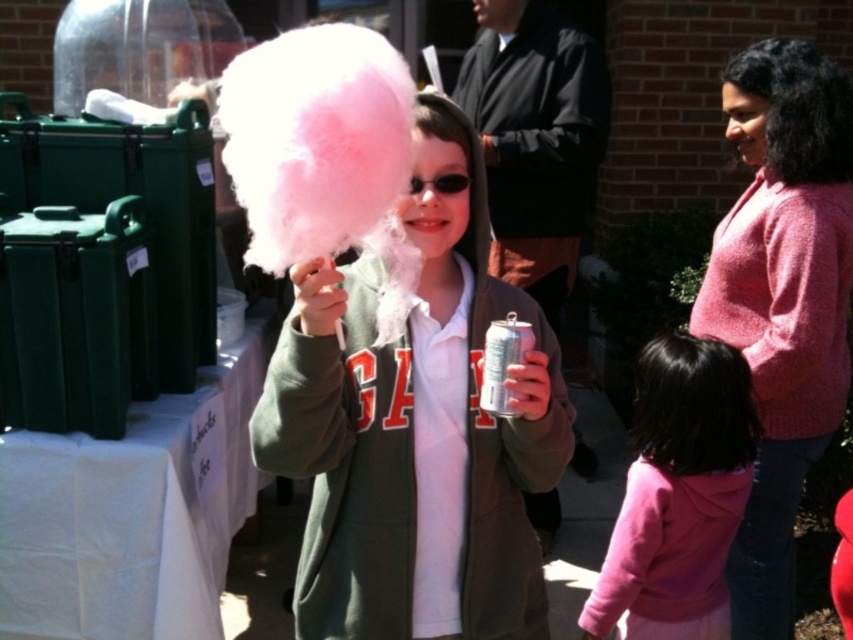
Who is shorter, pink fluffy cotton candy at center or pink fleece jacket at lower right?

pink fleece jacket at lower right

Identify the location of pink fluffy cotton candy at center. (415, 426).